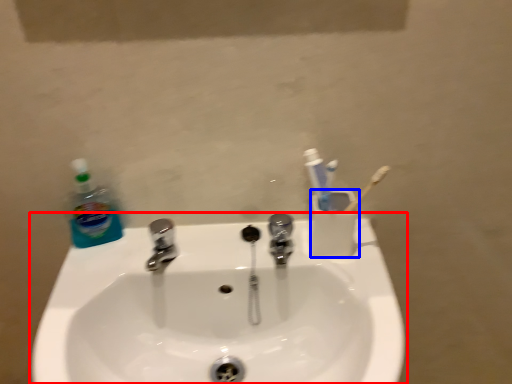
Question: Which object is closer to the camera taking this photo, sink (highlighted by a red box) or liquid (highlighted by a blue box)?

Choices:
 (A) sink
 (B) liquid

Answer: (A)